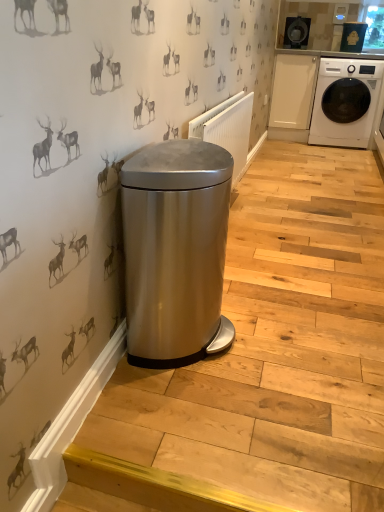
Question: Could you tell me if stainless steel trash can at lower left is facing satin silver trash can at center?

Choices:
 (A) yes
 (B) no

Answer: (B)

Question: Is stainless steel trash can at lower left not near satin silver trash can at center?

Choices:
 (A) no
 (B) yes

Answer: (A)

Question: Does stainless steel trash can at lower left have a lesser width compared to satin silver trash can at center?

Choices:
 (A) no
 (B) yes

Answer: (A)

Question: Can you see stainless steel trash can at lower left touching satin silver trash can at center?

Choices:
 (A) no
 (B) yes

Answer: (A)

Question: Considering the relative positions of stainless steel trash can at lower left and satin silver trash can at center in the image provided, is stainless steel trash can at lower left to the left of satin silver trash can at center from the viewer's perspective?

Choices:
 (A) no
 (B) yes

Answer: (A)

Question: Is the position of stainless steel trash can at lower left more distant than that of satin silver trash can at center?

Choices:
 (A) no
 (B) yes

Answer: (A)

Question: Is stainless steel trash can at lower left closer to camera compared to satin silver radiator at center?

Choices:
 (A) yes
 (B) no

Answer: (A)

Question: From a real-world perspective, does stainless steel trash can at lower left sit lower than satin silver radiator at center?

Choices:
 (A) yes
 (B) no

Answer: (A)

Question: Is stainless steel trash can at lower left to the right of satin silver radiator at center from the viewer's perspective?

Choices:
 (A) no
 (B) yes

Answer: (B)

Question: Can satin silver radiator at center be found inside stainless steel trash can at lower left?

Choices:
 (A) no
 (B) yes

Answer: (A)

Question: Does stainless steel trash can at lower left come behind satin silver radiator at center?

Choices:
 (A) no
 (B) yes

Answer: (A)

Question: Is stainless steel trash can at lower left shorter than satin silver radiator at center?

Choices:
 (A) yes
 (B) no

Answer: (A)

Question: Is the depth of satin silver radiator at center greater than that of stainless steel trash can at lower left?

Choices:
 (A) no
 (B) yes

Answer: (B)